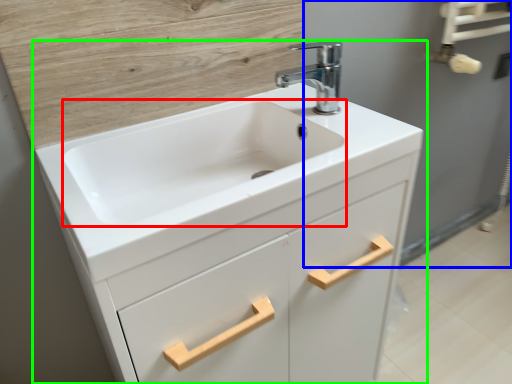
Question: Which object is positioned closest to sink (highlighted by a red box)? Select from screen door (highlighted by a blue box) and bathroom cabinet (highlighted by a green box).

Choices:
 (A) screen door
 (B) bathroom cabinet

Answer: (B)